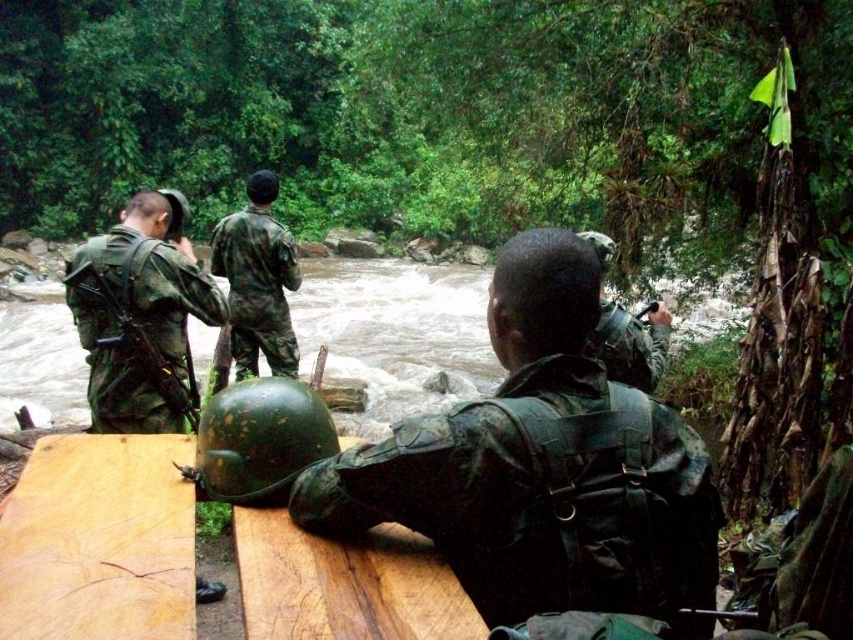
You are a drone operator tasked with capturing a closeup shot of the camouflage fabric helmet at center. What coordinates should you aim for to ensure the helmet is centered in your camera view?

The camouflage fabric helmet at center is located at point (540,468), so you should aim your camera at those coordinates to center the helmet.